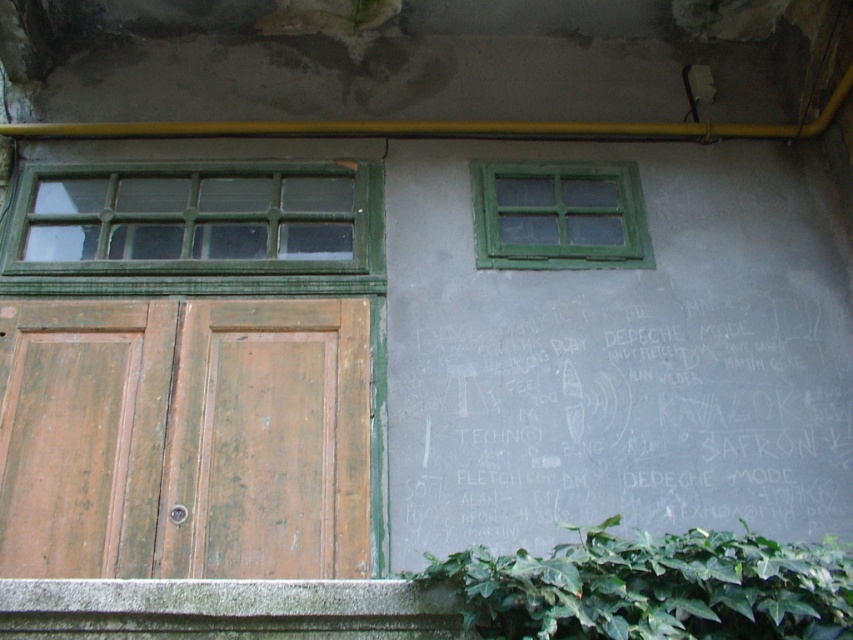
Question: Considering the real-world distances, which object is closest to the weathered wood door at left?

Choices:
 (A) black chalkboard at right
 (B) green wooden window at left
 (C) green leafy ivy at lower right
 (D) green painted wood window at upper right

Answer: (B)

Question: Can you confirm if green leafy ivy at lower right is positioned to the left of green wooden window at left?

Choices:
 (A) no
 (B) yes

Answer: (A)

Question: Does black chalkboard at right have a greater width compared to green leafy ivy at lower right?

Choices:
 (A) yes
 (B) no

Answer: (A)

Question: Which object is closer to the camera taking this photo?

Choices:
 (A) green wooden window at left
 (B) green painted wood window at upper right

Answer: (A)

Question: Based on their relative distances, which object is nearer to the black chalkboard at right?

Choices:
 (A) green painted wood window at upper right
 (B) green leafy ivy at lower right
 (C) weathered wood door at left
 (D) green wooden window at left

Answer: (A)

Question: In this image, where is black chalkboard at right located relative to green painted wood window at upper right?

Choices:
 (A) right
 (B) left

Answer: (A)